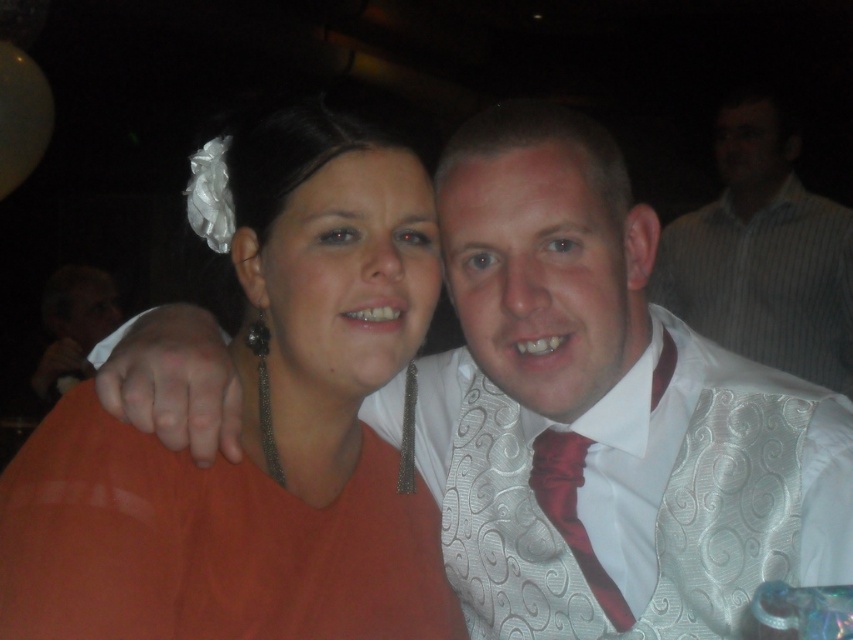
Question: Which point is farther to the camera?

Choices:
 (A) (347, 481)
 (B) (189, 513)
 (C) (840, 579)

Answer: (A)

Question: Is orange fabric at center smaller than white textured shirt at upper right?

Choices:
 (A) yes
 (B) no

Answer: (A)

Question: Which point appears closest to the camera in this image?

Choices:
 (A) (134, 573)
 (B) (654, 612)
 (C) (585, 442)
 (D) (827, 243)

Answer: (A)

Question: Does orange fabric dress at center appear on the right side of white textured shirt at upper right?

Choices:
 (A) yes
 (B) no

Answer: (B)

Question: Estimate the real-world distances between objects in this image. Which object is farther from the white textured dress shirt at center?

Choices:
 (A) orange fabric at center
 (B) shiny red tie at center
 (C) orange fabric dress at center

Answer: (C)

Question: Is orange fabric at center thinner than orange fabric dress at center?

Choices:
 (A) no
 (B) yes

Answer: (B)